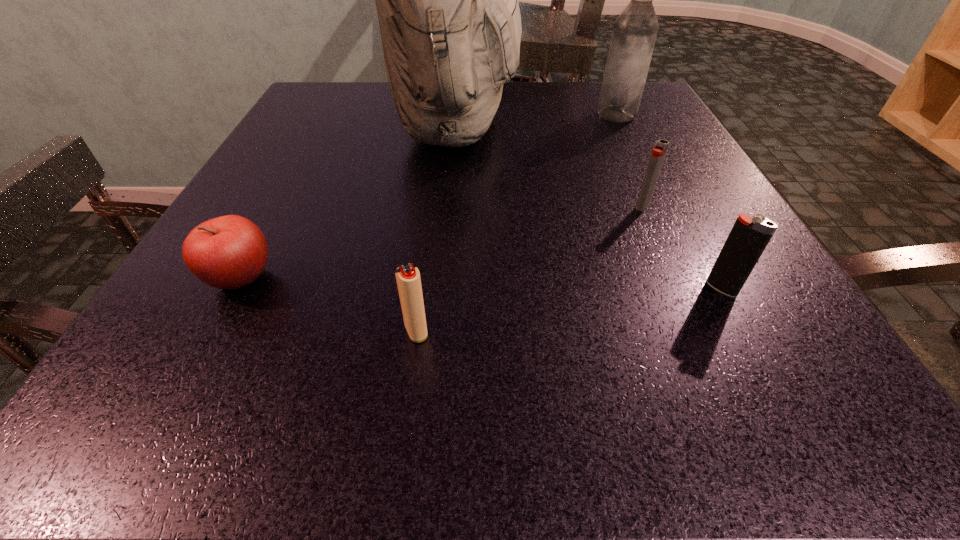
In order to click on vacant region located 0.120m on the front of the second nearest igniter in this screenshot , I will do `click(769, 379)`.

This screenshot has height=540, width=960. I want to click on free space located on the front of the fourth nearest object, so click(x=724, y=392).

The height and width of the screenshot is (540, 960). I want to click on free region located on the right of the nearest igniter, so click(645, 331).

You are a GUI agent. You are given a task and a screenshot of the screen. Output one action in this format:
    pyautogui.click(x=<x>, y=<y>)
    Task: Click on the free location located on the right of the leftmost object
    
    Given the screenshot: What is the action you would take?
    pyautogui.click(x=417, y=279)

Where is `backpack at the far edge`? Image resolution: width=960 pixels, height=540 pixels. backpack at the far edge is located at coordinates [447, 0].

Identify the location of water bottle present at the far edge. (635, 30).

At what (x,y) coordinates should I click in order to perform the action: click on object located at the left edge. Please return your answer as a coordinate pair (x, y). Looking at the image, I should click on (229, 252).

The width and height of the screenshot is (960, 540). I want to click on water bottle present at the right edge, so click(x=635, y=30).

You are a GUI agent. You are given a task and a screenshot of the screen. Output one action in this format:
    pyautogui.click(x=<x>, y=<y>)
    Task: Click on the object present at the far right corner
    The height and width of the screenshot is (540, 960).
    Given the screenshot: What is the action you would take?
    pyautogui.click(x=635, y=30)

At what (x,y) coordinates should I click in order to perform the action: click on vacant space at the far edge of the desktop. Please return your answer as a coordinate pair (x, y). The image size is (960, 540). Looking at the image, I should click on (546, 81).